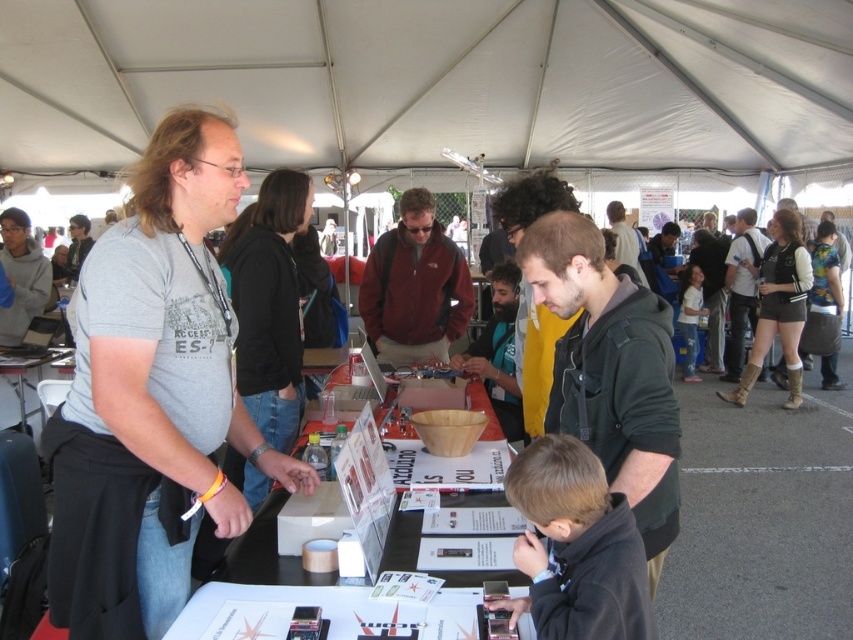
You are organizing a small science fair booth and need to place a sign on the table. The sign must be wider than the brown leather boots at right. Is the white paper at center wide enough to serve as the sign?

The white paper at center is wider than the brown leather boots at right, so it can be used as the sign.

What are the coordinates of the dark green hoodie at center in the image?

The coordinates of the dark green hoodie at center are at point (610, 371).